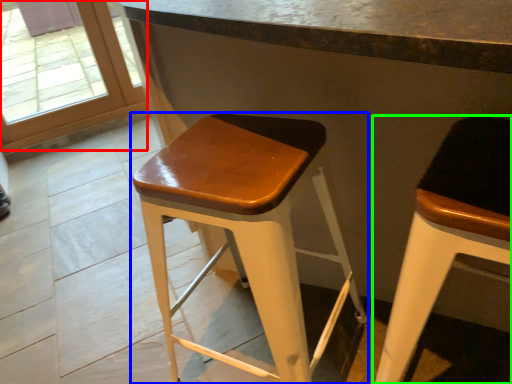
Question: Considering the real-world distances, which object is farthest from glass door (highlighted by a red box)? stool (highlighted by a blue box) or stool (highlighted by a green box)?

Choices:
 (A) stool
 (B) stool

Answer: (B)